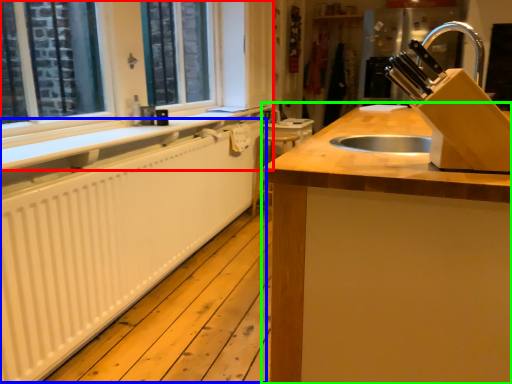
Question: Based on their relative distances, which object is nearer to window frame (highlighted by a red box)? Choose from radiator (highlighted by a blue box) and countertop (highlighted by a green box).

Choices:
 (A) radiator
 (B) countertop

Answer: (A)